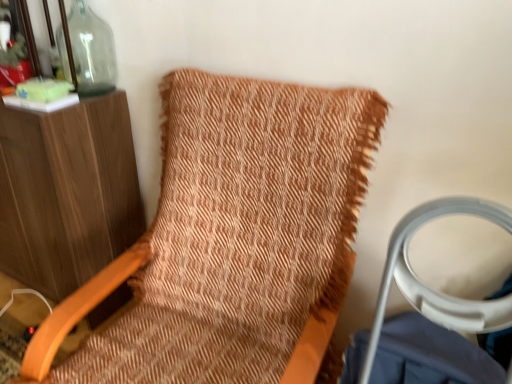
Question: From the image's perspective, is textured orange fabric bean bag chair at center located above or below transparent glass bottle at upper left?

Choices:
 (A) above
 (B) below

Answer: (B)

Question: From a real-world perspective, relative to transparent glass bottle at upper left, is textured orange fabric bean bag chair at center vertically above or below?

Choices:
 (A) below
 (B) above

Answer: (A)

Question: Considering the positions of textured orange fabric bean bag chair at center and transparent glass bottle at upper left in the image, is textured orange fabric bean bag chair at center taller or shorter than transparent glass bottle at upper left?

Choices:
 (A) short
 (B) tall

Answer: (B)

Question: Based on their sizes in the image, would you say transparent glass bottle at upper left is bigger or smaller than textured orange fabric bean bag chair at center?

Choices:
 (A) big
 (B) small

Answer: (B)

Question: Considering the positions of transparent glass bottle at upper left and textured orange fabric bean bag chair at center in the image, is transparent glass bottle at upper left wider or thinner than textured orange fabric bean bag chair at center?

Choices:
 (A) thin
 (B) wide

Answer: (A)

Question: From the image's perspective, is transparent glass bottle at upper left above or below textured orange fabric bean bag chair at center?

Choices:
 (A) above
 (B) below

Answer: (A)

Question: In terms of height, does transparent glass bottle at upper left look taller or shorter compared to textured orange fabric bean bag chair at center?

Choices:
 (A) tall
 (B) short

Answer: (B)